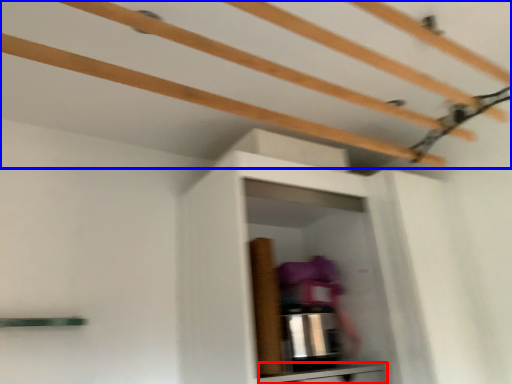
Question: Which of the following is the farthest to the observer, cabinetry (highlighted by a red box) or shelf (highlighted by a blue box)?

Choices:
 (A) cabinetry
 (B) shelf

Answer: (A)